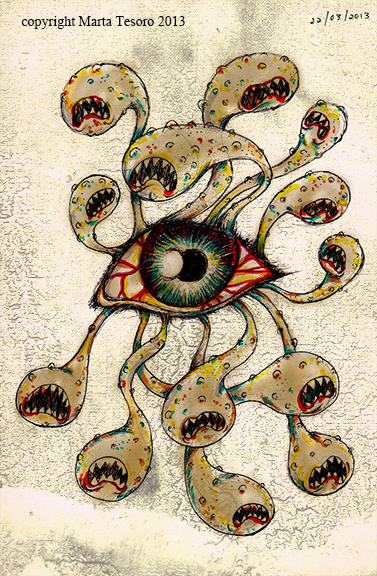
Locate an element on the screen. This screenshot has width=377, height=576. art work is located at coordinates (156, 477).